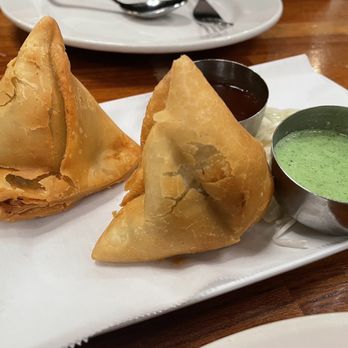
The image size is (348, 348). In order to click on white plate in this screenshot , I will do point(265,278), point(268,281).